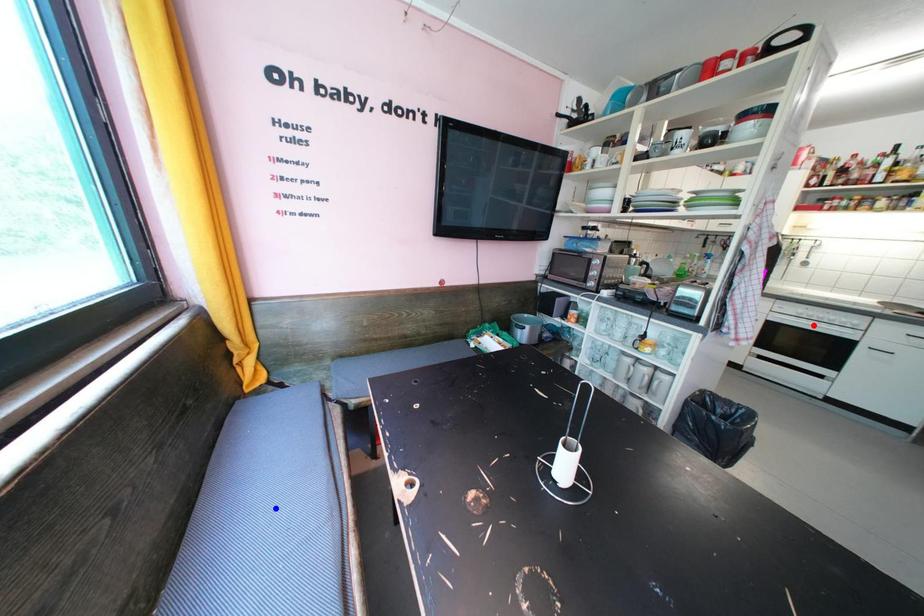
Question: Which of the two points in the image is closer to the camera?

Choices:
 (A) Blue point is closer.
 (B) Red point is closer.

Answer: (A)